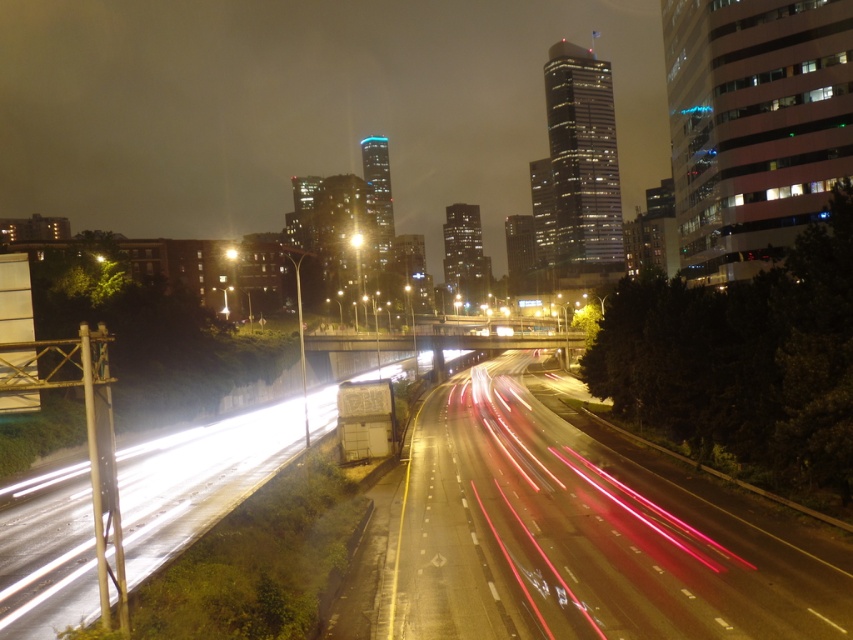
You are a driver approaching the intersection at night. You see the metallic asphalt highway at center and the bright yellow light at center. Which one is closer to your left side?

The bright yellow light at center is closer to your left side because the metallic asphalt highway at center is to the right of it.

You are a drone operator trying to capture the metallic asphalt highway at center in your camera frame. You notice a point labeled as point [570,538] on your screen. Can you confirm if this point is located on the metallic asphalt highway at center?

Yes, the point [570,538] is located on the metallic asphalt highway at center as per the description.

You are a photographer standing at the camera position capturing this nighttime highway scene. You notice two points in the image labeled as point 1 at coordinates (503, 552) and point 2 at coordinates (357, 243). Which point is closer to your camera position?

Point 1 at coordinates (503, 552) is closer to the camera than point 2 at coordinates (357, 243).